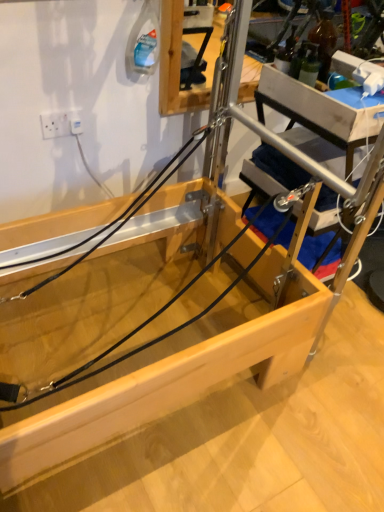
Question: Looking at their shapes, would you say transparent plastic at center is wider or thinner than white plastic electric outlet at upper left?

Choices:
 (A) thin
 (B) wide

Answer: (B)

Question: In the image, is transparent plastic at center on the left side or the right side of white plastic electric outlet at upper left?

Choices:
 (A) right
 (B) left

Answer: (A)

Question: Is point (13, 408) positioned closer to the camera than point (44, 130)?

Choices:
 (A) closer
 (B) farther

Answer: (A)

Question: Considering their positions, is white plastic electric outlet at upper left located in front of or behind transparent plastic at center?

Choices:
 (A) behind
 (B) front

Answer: (A)

Question: From their relative heights in the image, would you say white plastic electric outlet at upper left is taller or shorter than transparent plastic at center?

Choices:
 (A) short
 (B) tall

Answer: (B)

Question: Is white plastic electric outlet at upper left to the left or to the right of transparent plastic at center in the image?

Choices:
 (A) left
 (B) right

Answer: (A)

Question: Looking at their shapes, would you say white plastic electric outlet at upper left is wider or thinner than transparent plastic at center?

Choices:
 (A) wide
 (B) thin

Answer: (B)